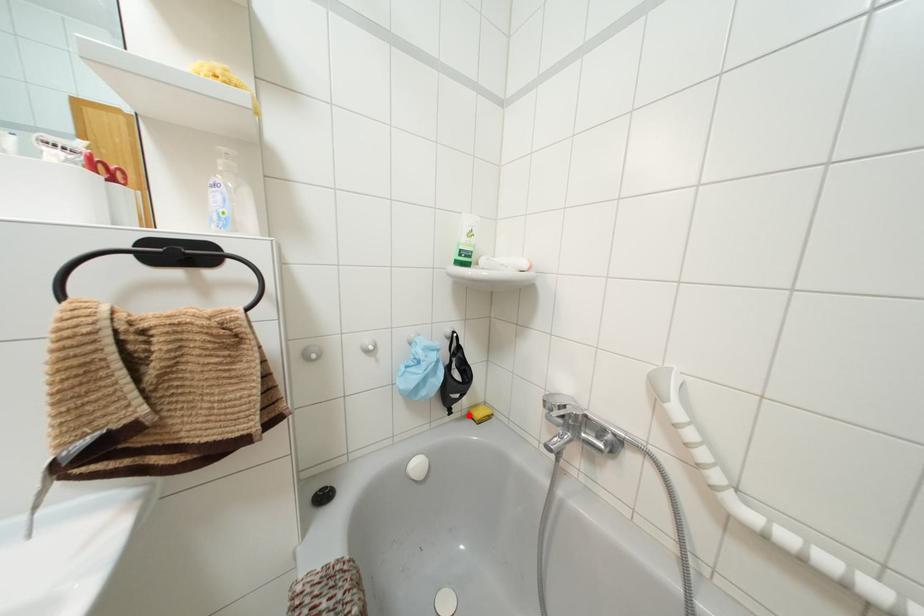
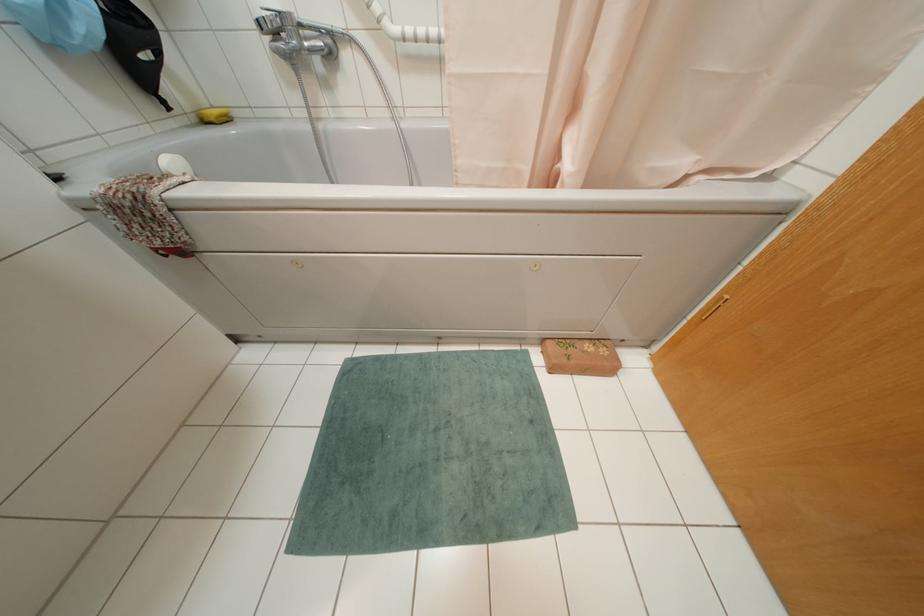
Locate, in the second image, the point that corresponds to the highlighted location in the first image.

(202, 121)